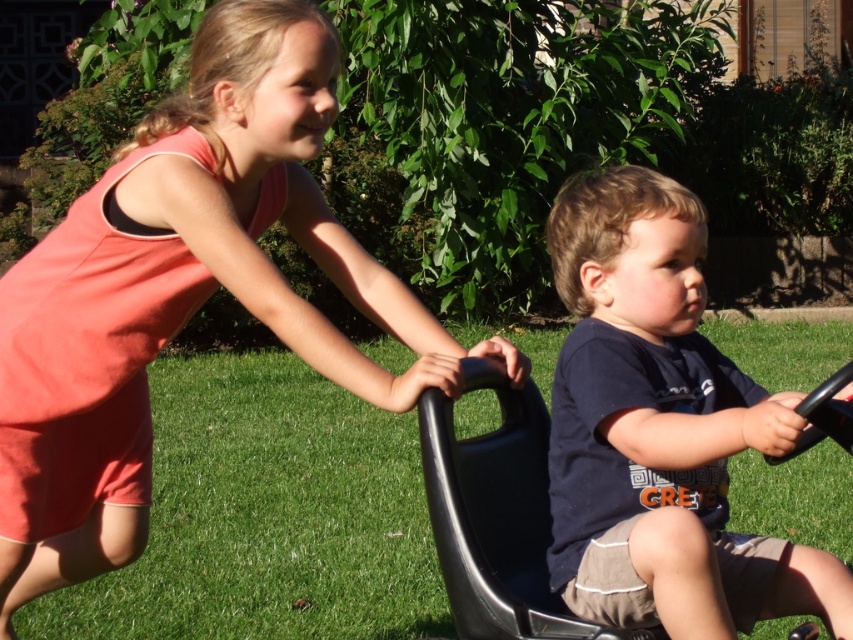
Where is `matte pink dress at upper left`? matte pink dress at upper left is located at coordinates (183, 292).

In the scene shown: Does matte pink dress at upper left have a lesser height compared to green grass at center?

No.

Which is in front, point (45, 572) or point (320, 476)?

Point (45, 572) is more forward.

Locate an element on the screen. The height and width of the screenshot is (640, 853). matte pink dress at upper left is located at coordinates point(183,292).

Can you confirm if matte pink dress at upper left is positioned to the left of dark blue t-shirt at center?

Yes, matte pink dress at upper left is to the left of dark blue t-shirt at center.

Identify the location of matte pink dress at upper left. Image resolution: width=853 pixels, height=640 pixels. (183, 292).

Describe the element at coordinates (183, 292) in the screenshot. I see `matte pink dress at upper left` at that location.

Identify the location of matte pink dress at upper left. The width and height of the screenshot is (853, 640). (x=183, y=292).

Can you confirm if green grass at center is taller than dark blue t-shirt at center?

Incorrect, green grass at center's height is not larger of dark blue t-shirt at center's.

Is point (196, 467) positioned before point (550, 490)?

No, (196, 467) is behind (550, 490).

This screenshot has width=853, height=640. Describe the element at coordinates (267, 515) in the screenshot. I see `green grass at center` at that location.

At what (x,y) coordinates should I click in order to perform the action: click on green grass at center. Please return your answer as a coordinate pair (x, y). The width and height of the screenshot is (853, 640). Looking at the image, I should click on (267, 515).